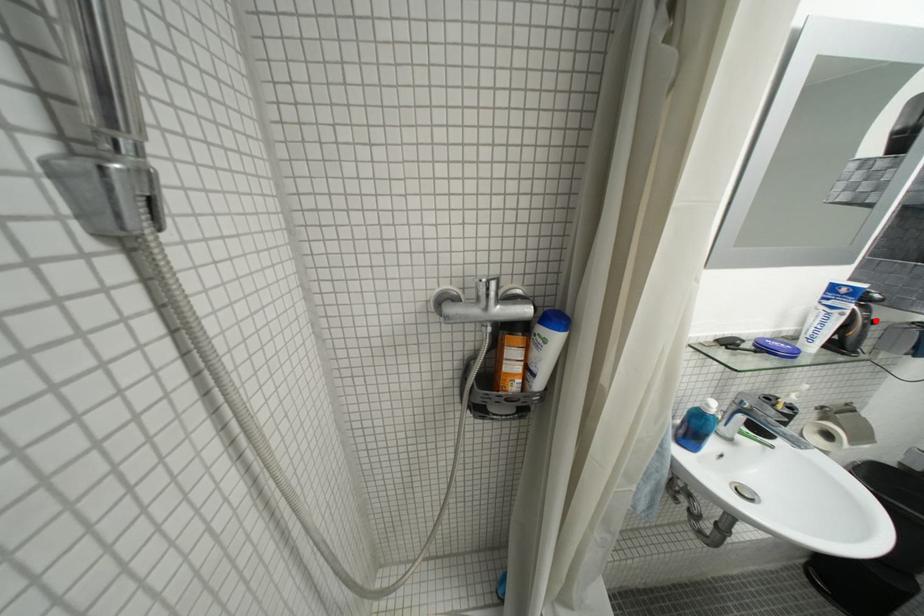
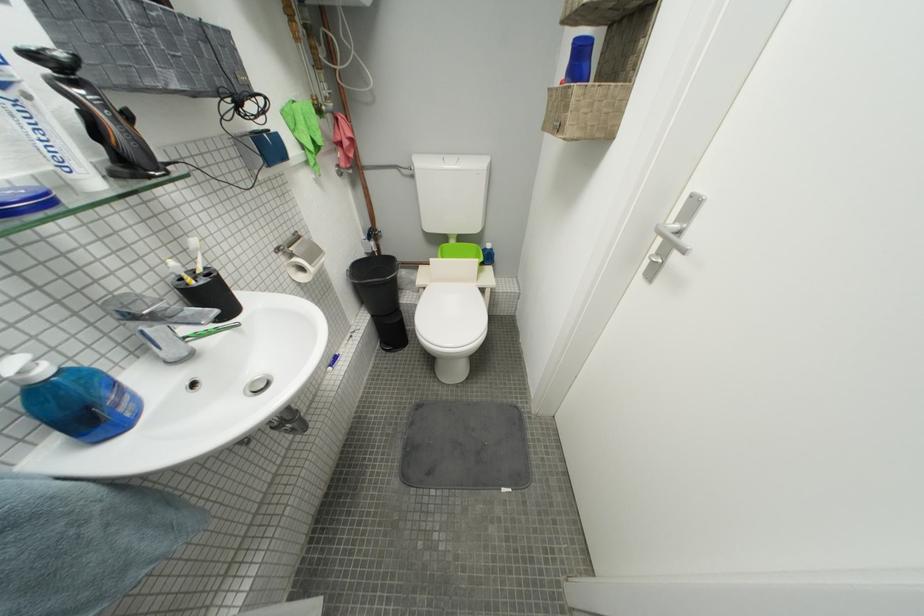
The point at the highlighted location is marked in the first image. Where is the corresponding point in the second image?

(114, 108)